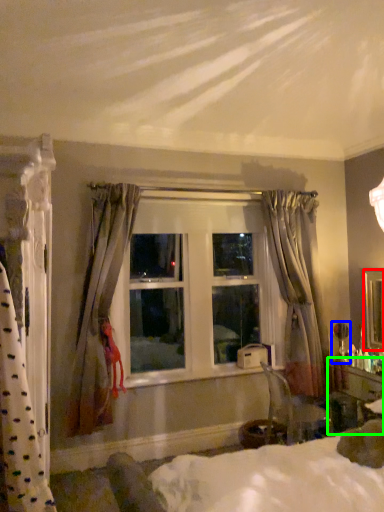
Question: Estimate the real-world distances between objects in this image. Which object is farther from mirror (highlighted by a red box), table lamp (highlighted by a blue box) or vanity (highlighted by a green box)?

Choices:
 (A) table lamp
 (B) vanity

Answer: (B)